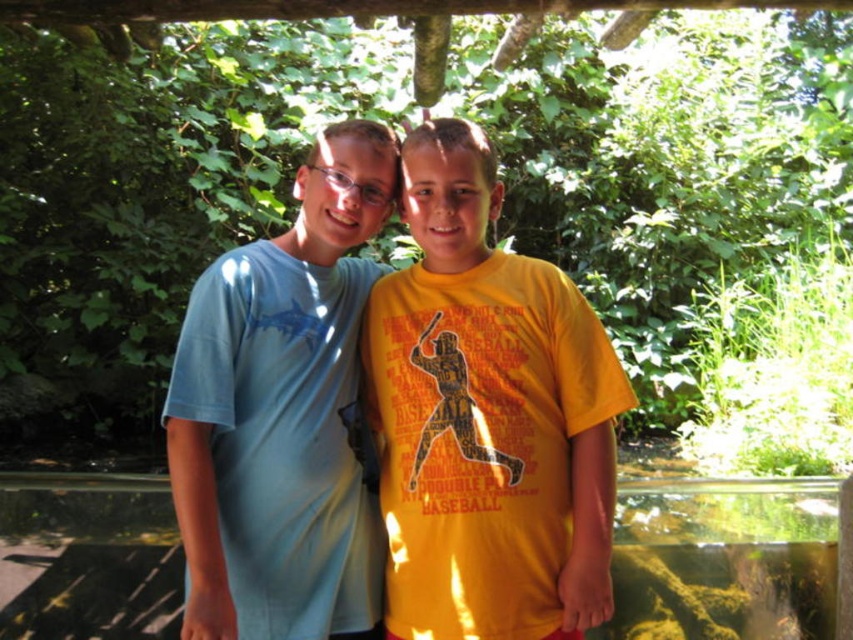
You are a photographer trying to capture the light blue cotton shirt at left in the image. The camera is focused on the point at coordinates (x=282, y=413). Is this point likely to be on the light blue cotton shirt at left?

Yes, the point at coordinates (x=282, y=413) marks the light blue cotton shirt at left, so the camera is focused on it.